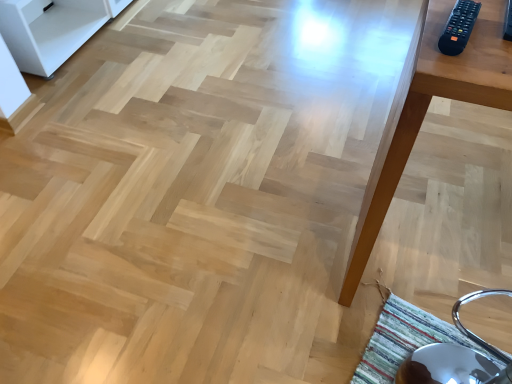
At what (x,y) coordinates should I click in order to perform the action: click on vacant space to the left of light brown wood table at right. Please return your answer as a coordinate pair (x, y). Image resolution: width=512 pixels, height=384 pixels. Looking at the image, I should click on (290, 261).